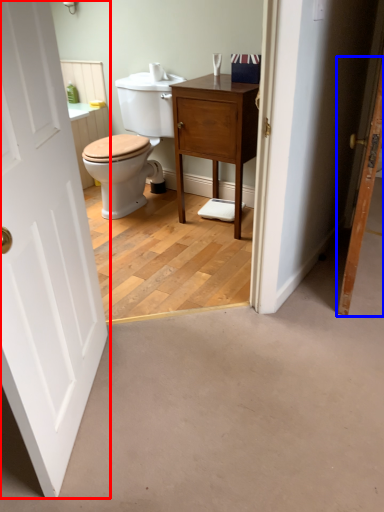
Question: Which object appears farthest to the camera in this image, door (highlighted by a red box) or door (highlighted by a blue box)?

Choices:
 (A) door
 (B) door

Answer: (B)